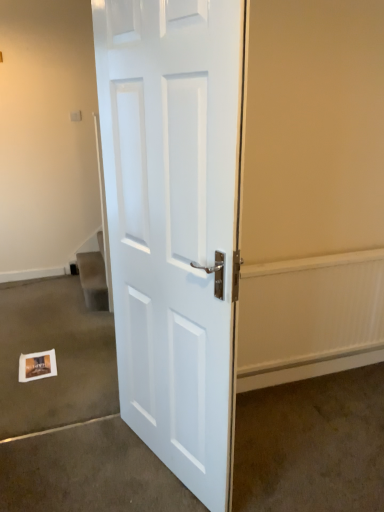
Question: Is white matte postcard at lower left next to matte white door at center, marked as the 2th concrete in a left-to-right arrangement?

Choices:
 (A) yes
 (B) no

Answer: (B)

Question: Considering the relative sizes of white matte postcard at lower left and matte white door at center, the 1th concrete viewed from the right, in the image provided, is white matte postcard at lower left taller than matte white door at center, the 1th concrete viewed from the right,?

Choices:
 (A) no
 (B) yes

Answer: (A)

Question: From a real-world perspective, is white matte postcard at lower left beneath matte white door at center, marked as the 2th concrete in a left-to-right arrangement?

Choices:
 (A) yes
 (B) no

Answer: (B)

Question: From a real-world perspective, is white matte postcard at lower left on top of matte white door at center, marked as the 2th concrete in a left-to-right arrangement?

Choices:
 (A) no
 (B) yes

Answer: (B)

Question: Is white matte postcard at lower left wider than matte white door at center, marked as the 2th concrete in a left-to-right arrangement?

Choices:
 (A) no
 (B) yes

Answer: (A)

Question: In terms of height, does white paper at lower left, the 2th concrete viewed from the right, look taller or shorter compared to white glossy door at center?

Choices:
 (A) tall
 (B) short

Answer: (B)

Question: From the image's perspective, is white paper at lower left, the 1th concrete positioned from the left, located above or below white glossy door at center?

Choices:
 (A) below
 (B) above

Answer: (A)

Question: Is point (1, 297) closer or farther from the camera than point (137, 249)?

Choices:
 (A) farther
 (B) closer

Answer: (A)

Question: Relative to white glossy door at center, is white paper at lower left, the 2th concrete viewed from the right, in front or behind?

Choices:
 (A) behind
 (B) front

Answer: (A)

Question: Is white matte postcard at lower left wider or thinner than white paper at lower left, the 1th concrete positioned from the left?

Choices:
 (A) wide
 (B) thin

Answer: (B)

Question: Does point (23, 370) appear closer or farther from the camera than point (3, 373)?

Choices:
 (A) closer
 (B) farther

Answer: (A)

Question: From the image's perspective, is white matte postcard at lower left positioned above or below white paper at lower left, the 2th concrete viewed from the right?

Choices:
 (A) above
 (B) below

Answer: (B)

Question: In the image, is white matte postcard at lower left positioned in front of or behind white paper at lower left, the 1th concrete positioned from the left?

Choices:
 (A) front
 (B) behind

Answer: (B)

Question: Would you say white glossy door at center is to the left or to the right of white paper at lower left, the 1th concrete positioned from the left, in the picture?

Choices:
 (A) left
 (B) right

Answer: (B)

Question: Based on their sizes in the image, would you say white glossy door at center is bigger or smaller than white paper at lower left, the 2th concrete viewed from the right?

Choices:
 (A) small
 (B) big

Answer: (B)